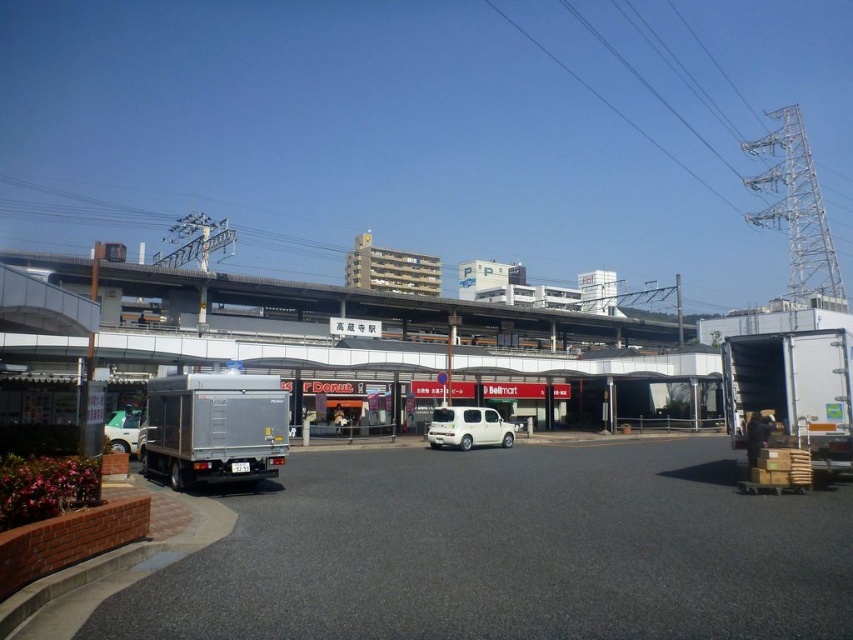
You are a drone operator trying to fly a drone from the silver metallic truck at lower left to the white metallic power line at upper right. Considering the spatial relationship between them, can your drone safely pass under the power line without any collision?

The white metallic power line at upper right is further to the viewer than the silver metallic truck at lower left, meaning the power line is closer to you. Therefore, your drone would need to fly upwards to avoid collision with the power line when moving from the silver metallic truck at lower left to the white metallic power line at upper right.

You are a drone operator trying to deliver a package to a location marked by the point at coordinates point (724, 196). The drone has a wingspan of 0.2 meters. You need to fly the drone under a white metallic power line at upper right. Can the drone safely pass under the power line at the specified point?

The point (724, 196) is on the white metallic power line at upper right, so the drone cannot safely pass under the power line at that point because the point is directly on the power line, leaving no clearance for the drone.

You are a delivery driver who needs to pass under the metallic gray overpass at center with your trailer truck. Can your silver metallic trailer truck at lower left fit under it based on their sizes?

The metallic gray overpass at center is larger in size than the silver metallic trailer truck at lower left, so the truck should be able to pass under it without any issues.